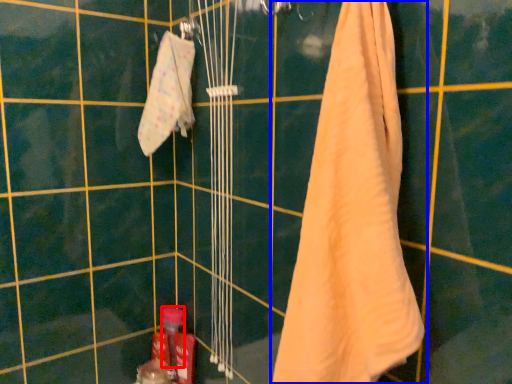
Question: Among these objects, which one is nearest to the camera, toiletry (highlighted by a red box) or towel (highlighted by a blue box)?

Choices:
 (A) toiletry
 (B) towel

Answer: (B)